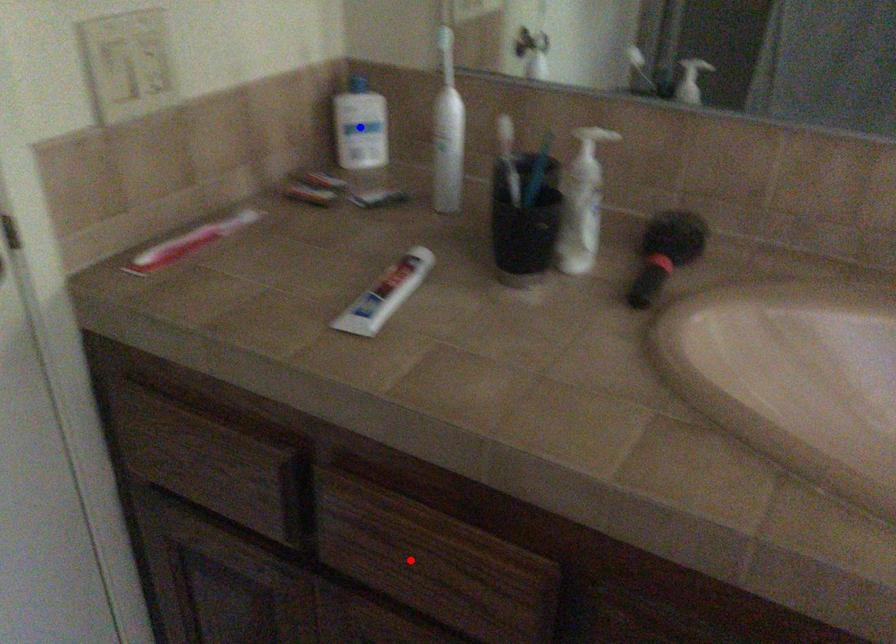
Question: Two points are marked on the image. Which point is closer to the camera?

Choices:
 (A) Blue point is closer.
 (B) Red point is closer.

Answer: (B)